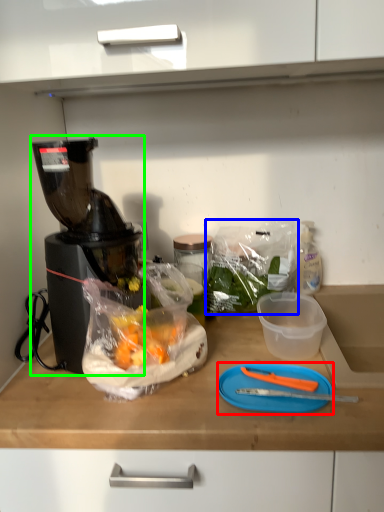
Question: Which object is the closest to the cutting board (highlighted by a red box)? Choose among these: plastic bag (highlighted by a blue box) or blender (highlighted by a green box).

Choices:
 (A) plastic bag
 (B) blender

Answer: (A)